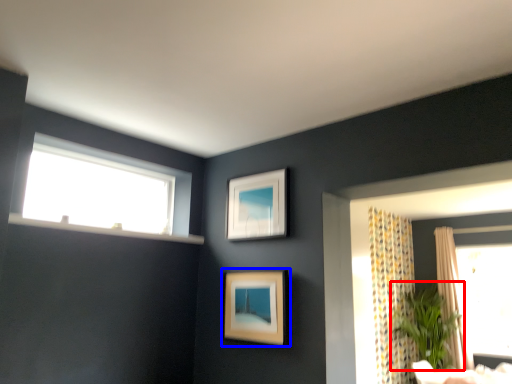
Question: Which object is closer to the camera taking this photo, plant (highlighted by a red box) or picture frame (highlighted by a blue box)?

Choices:
 (A) plant
 (B) picture frame

Answer: (B)